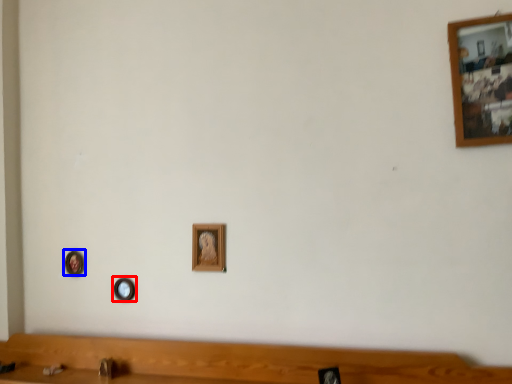
Question: Among these objects, which one is farthest to the camera, picture frame (highlighted by a red box) or picture frame (highlighted by a blue box)?

Choices:
 (A) picture frame
 (B) picture frame

Answer: (B)